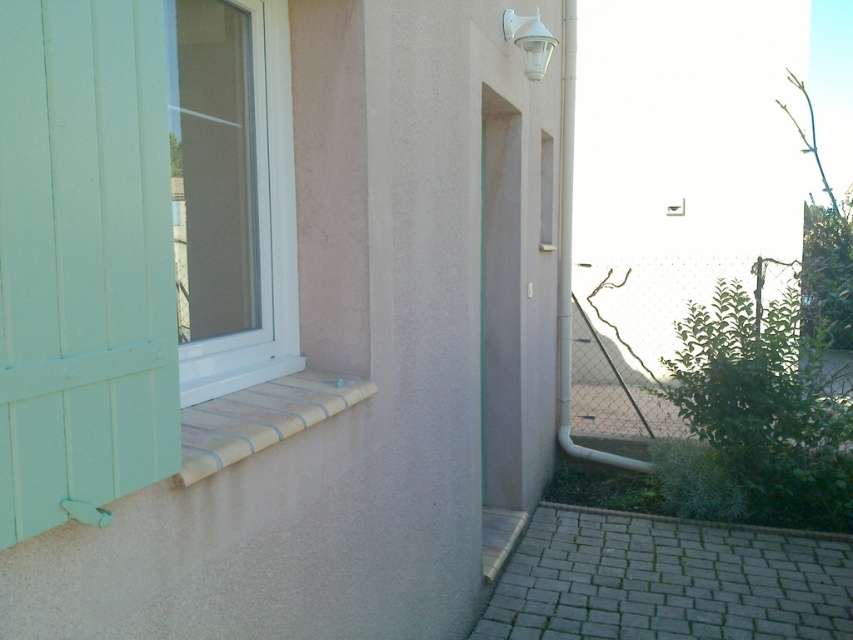
Question: Can you confirm if mint wood shutter at left is thinner than transparent plastic screen door at center?

Choices:
 (A) no
 (B) yes

Answer: (B)

Question: Can you confirm if mint wood shutter at left is thinner than brown textured stone at lower left?

Choices:
 (A) no
 (B) yes

Answer: (B)

Question: Which point is closer to the camera?

Choices:
 (A) transparent plastic screen door at center
 (B) brown textured stone at lower left
 (C) mint wood shutter at left
 (D) white plastic window at left

Answer: (C)

Question: Which point is farther to the camera?

Choices:
 (A) white plastic window at left
 (B) mint wood shutter at left
 (C) transparent plastic screen door at center

Answer: (C)

Question: Does mint wood shutter at left have a lesser width compared to brown textured stone at lower left?

Choices:
 (A) no
 (B) yes

Answer: (B)

Question: Considering the real-world distances, which object is closest to the transparent plastic screen door at center?

Choices:
 (A) white plastic window at left
 (B) mint wood shutter at left
 (C) brown textured stone at lower left

Answer: (A)